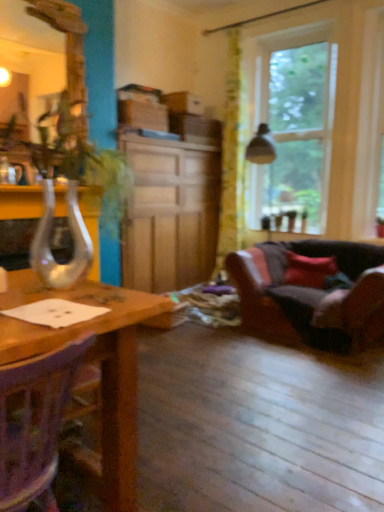
Question: From a real-world perspective, relative to clear glass vase at left, is red velvet cushion at right vertically above or below?

Choices:
 (A) below
 (B) above

Answer: (A)

Question: Based on their positions, is red velvet cushion at right located to the left or right of clear glass vase at left?

Choices:
 (A) right
 (B) left

Answer: (A)

Question: Which object is the closest to the wooden cabinet at center?

Choices:
 (A) clear glass vase at left
 (B) green floral fabric curtain at upper center
 (C) red velvet cushion at right
 (D) clear glass vase at left
 (E) leather couch at lower right

Answer: (B)

Question: Based on their relative distances, which object is nearer to the clear glass window at upper right?

Choices:
 (A) wooden chair at lower left
 (B) green floral fabric curtain at upper center
 (C) wooden cabinet at center
 (D) red velvet cushion at right
 (E) leather couch at lower right

Answer: (B)